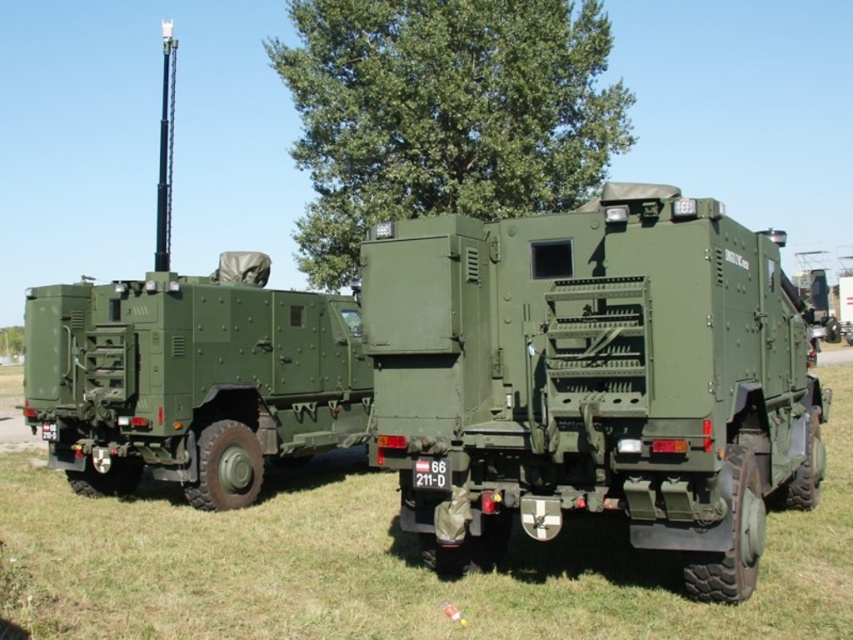
Question: Is matte green truck at center in front of green matte grass at lower center?

Choices:
 (A) no
 (B) yes

Answer: (A)

Question: Considering the real-world distances, which object is closest to the matte green military vehicle at left?

Choices:
 (A) green leafy tree at upper center
 (B) green matte grass at lower center
 (C) matte green truck at center

Answer: (B)

Question: Among these objects, which one is nearest to the camera?

Choices:
 (A) matte green military vehicle at left
 (B) matte green truck at center
 (C) green matte grass at lower center

Answer: (C)

Question: Is matte green truck at center smaller than green leafy tree at upper center?

Choices:
 (A) yes
 (B) no

Answer: (A)

Question: Which object is farther from the camera taking this photo?

Choices:
 (A) matte green truck at center
 (B) matte green military vehicle at left
 (C) green matte grass at lower center

Answer: (B)

Question: Can you confirm if matte green truck at center is positioned above matte green military vehicle at left?

Choices:
 (A) yes
 (B) no

Answer: (B)